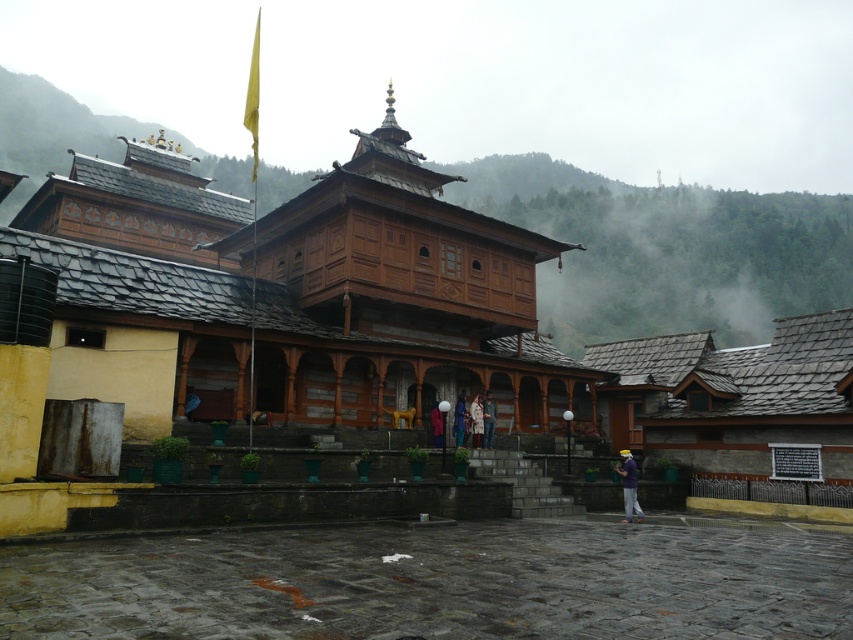
Can you confirm if white fabric coat at center is positioned above light brown wooden statue at center?

Yes, white fabric coat at center is above light brown wooden statue at center.

Between point (495, 401) and point (460, 420), which one is positioned in front?

Point (460, 420) is more forward.

Find the location of a particular element. The image size is (853, 640). white fabric coat at center is located at coordinates (488, 419).

Is wooden temple at center smaller than white fabric coat at center?

→ Actually, wooden temple at center might be larger than white fabric coat at center.

Which is above, wooden temple at center or white fabric coat at center?

Positioned higher is wooden temple at center.

Between point (535, 240) and point (490, 438), which one is positioned in front?

Point (490, 438) is in front.

Where is `wooden temple at center`? This screenshot has height=640, width=853. wooden temple at center is located at coordinates (291, 294).

Between purple cotton shirt at lower right and light brown wooden statue at center, which one has more height?

With more height is light brown wooden statue at center.

Can you confirm if purple cotton shirt at lower right is shorter than light brown wooden statue at center?

Indeed, purple cotton shirt at lower right has a lesser height compared to light brown wooden statue at center.

Where is `purple cotton shirt at lower right`? The image size is (853, 640). purple cotton shirt at lower right is located at coordinates (630, 486).

Where is `purple cotton shirt at lower right`? The image size is (853, 640). purple cotton shirt at lower right is located at coordinates (630, 486).